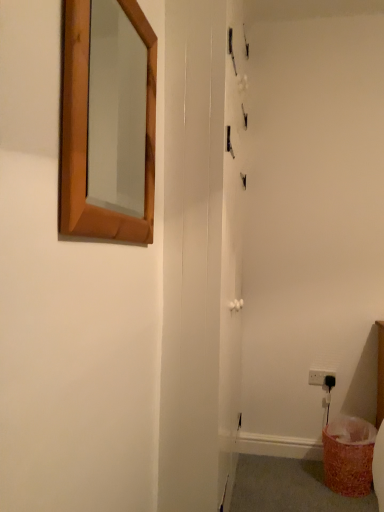
What do you see at coordinates (116, 111) in the screenshot? The image size is (384, 512). I see `wooden-framed mirror at upper left` at bounding box center [116, 111].

The width and height of the screenshot is (384, 512). Identify the location of wooden-framed mirror at upper left. point(116,111).

Could you measure the distance between orange textured laundry basket at lower right and white plastic electric outlet at lower right?

orange textured laundry basket at lower right and white plastic electric outlet at lower right are 15.69 inches apart.

Does orange textured laundry basket at lower right have a larger size compared to white plastic electric outlet at lower right?

Indeed, orange textured laundry basket at lower right has a larger size compared to white plastic electric outlet at lower right.

Is orange textured laundry basket at lower right facing away from white plastic electric outlet at lower right?

No, orange textured laundry basket at lower right is not facing the opposite direction of white plastic electric outlet at lower right.

Is orange textured laundry basket at lower right positioned far away from white plastic electric outlet at lower right?

No, orange textured laundry basket at lower right is in close proximity to white plastic electric outlet at lower right.

Looking at this image, considering the relative sizes of white plastic electric outlet at lower right and wooden-framed mirror at upper left in the image provided, is white plastic electric outlet at lower right bigger than wooden-framed mirror at upper left?

No, white plastic electric outlet at lower right is not bigger than wooden-framed mirror at upper left.

From a real-world perspective, is white plastic electric outlet at lower right over wooden-framed mirror at upper left?

No.

Does white plastic electric outlet at lower right have a lesser width compared to wooden-framed mirror at upper left?

Yes.

Is point (312, 381) closer or farther from the camera than point (141, 144)?

Point (312, 381) appears to be farther away from the viewer than point (141, 144).

Does wooden-framed mirror at upper left touch white plastic electric outlet at lower right?

No.

From a real-world perspective, is wooden-framed mirror at upper left located higher than white plastic electric outlet at lower right?

Yes, from a real-world perspective, wooden-framed mirror at upper left is over white plastic electric outlet at lower right

Which of these two, wooden-framed mirror at upper left or white plastic electric outlet at lower right, is smaller?

white plastic electric outlet at lower right is smaller.

Does point (111, 149) appear closer or farther from the camera than point (320, 371)?

Point (111, 149).

Based on their sizes in the image, would you say white plastic electric outlet at lower right is bigger or smaller than orange textured laundry basket at lower right?

white plastic electric outlet at lower right is smaller than orange textured laundry basket at lower right.

Based on the photo, is white plastic electric outlet at lower right not near orange textured laundry basket at lower right?

They are positioned close to each other.

Is point (318, 371) more distant than point (335, 439)?

Yes, point (318, 371) is farther from viewer.

From the image's perspective, does white plastic electric outlet at lower right appear lower than orange textured laundry basket at lower right?

No, from the image's perspective, white plastic electric outlet at lower right is not below orange textured laundry basket at lower right.

From the image's perspective, between wooden-framed mirror at upper left and orange textured laundry basket at lower right, who is located below?

orange textured laundry basket at lower right.

Is wooden-framed mirror at upper left oriented away from orange textured laundry basket at lower right?

No, orange textured laundry basket at lower right is not at the back of wooden-framed mirror at upper left.

Considering the sizes of objects wooden-framed mirror at upper left and orange textured laundry basket at lower right in the image provided, who is smaller, wooden-framed mirror at upper left or orange textured laundry basket at lower right?

With smaller size is wooden-framed mirror at upper left.

Is wooden-framed mirror at upper left next to orange textured laundry basket at lower right?

No, wooden-framed mirror at upper left is not in contact with orange textured laundry basket at lower right.

Which object is thinner, white plastic electric outlet at lower right or white glossy screen door at center?

With smaller width is white plastic electric outlet at lower right.

Is there a large distance between white plastic electric outlet at lower right and white glossy screen door at center?

Absolutely, white plastic electric outlet at lower right is distant from white glossy screen door at center.

Is white plastic electric outlet at lower right positioned with its back to white glossy screen door at center?

white plastic electric outlet at lower right does not have its back to white glossy screen door at center.

From a real-world perspective, relative to white glossy screen door at center, is white plastic electric outlet at lower right vertically above or below?

In terms of real-world spatial position, white plastic electric outlet at lower right is below white glossy screen door at center.

Does orange textured laundry basket at lower right appear on the left side of wooden-framed mirror at upper left?

In fact, orange textured laundry basket at lower right is to the right of wooden-framed mirror at upper left.

Is orange textured laundry basket at lower right smaller than wooden-framed mirror at upper left?

No.

Measure the distance between orange textured laundry basket at lower right and wooden-framed mirror at upper left.

orange textured laundry basket at lower right is 5.75 feet from wooden-framed mirror at upper left.

From the image's perspective, is orange textured laundry basket at lower right above or below wooden-framed mirror at upper left?

orange textured laundry basket at lower right is situated lower than wooden-framed mirror at upper left in the image.

What are the coordinates of `laundry basket in front of the white plastic electric outlet at lower right` in the screenshot? It's located at (348, 455).

Find the location of a particular element. mirror on the left of white plastic electric outlet at lower right is located at coordinates [116, 111].

Based on their spatial positions, is orange textured laundry basket at lower right or white plastic electric outlet at lower right closer to wooden-framed mirror at upper left?

orange textured laundry basket at lower right is closer to wooden-framed mirror at upper left.

Based on their spatial positions, is wooden-framed mirror at upper left or orange textured laundry basket at lower right further from white plastic electric outlet at lower right?

The object further to white plastic electric outlet at lower right is wooden-framed mirror at upper left.

When comparing their distances from orange textured laundry basket at lower right, does wooden-framed mirror at upper left or white glossy screen door at center seem closer?

Based on the image, white glossy screen door at center appears to be nearer to orange textured laundry basket at lower right.

From the image, which object appears to be nearer to orange textured laundry basket at lower right, wooden-framed mirror at upper left or white plastic electric outlet at lower right?

Based on the image, white plastic electric outlet at lower right appears to be nearer to orange textured laundry basket at lower right.

When comparing their distances from white plastic electric outlet at lower right, does orange textured laundry basket at lower right or white glossy screen door at center seem closer?

orange textured laundry basket at lower right is closer to white plastic electric outlet at lower right.

From the image, which object appears to be farther from orange textured laundry basket at lower right, white plastic electric outlet at lower right or white glossy screen door at center?

Among the two, white glossy screen door at center is located further to orange textured laundry basket at lower right.

In the scene shown: Which object lies nearer to the anchor point orange textured laundry basket at lower right, white glossy screen door at center or white plastic electric outlet at lower right?

The object closer to orange textured laundry basket at lower right is white plastic electric outlet at lower right.

Based on their spatial positions, is orange textured laundry basket at lower right or white plastic electric outlet at lower right further from white glossy screen door at center?

white plastic electric outlet at lower right lies further to white glossy screen door at center than the other object.

Where is `laundry basket located between wooden-framed mirror at upper left and white plastic electric outlet at lower right in the depth direction`? The width and height of the screenshot is (384, 512). laundry basket located between wooden-framed mirror at upper left and white plastic electric outlet at lower right in the depth direction is located at coordinates (348, 455).

Identify the location of screen door between wooden-framed mirror at upper left and orange textured laundry basket at lower right in the vertical direction. The height and width of the screenshot is (512, 384). (192, 254).

Identify the location of screen door between wooden-framed mirror at upper left and white plastic electric outlet at lower right from front to back. This screenshot has width=384, height=512. (192, 254).

The height and width of the screenshot is (512, 384). I want to click on electric outlet between white glossy screen door at center and orange textured laundry basket at lower right vertically, so [x=322, y=378].